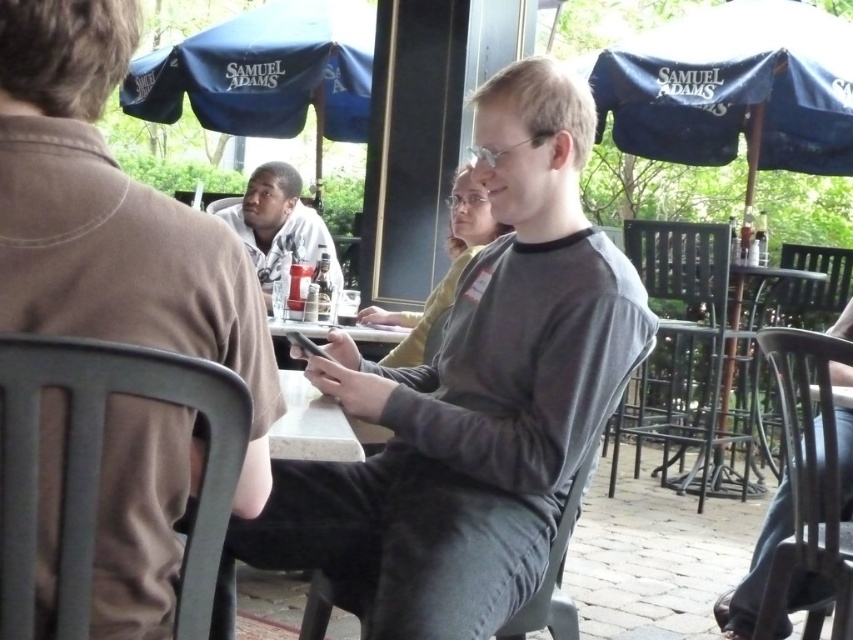
You are trying to reach the smooth plastic table at center from behind the gray matte shirt at center. Can you walk directly to the table without moving the shirt?

The gray matte shirt at center is in front of the smooth plastic table at center, so you cannot walk directly to the table without moving the shirt.

You are standing in the outdoor seating area and want to know which of the two points, point (267,220) or point (274,330), is closer to you. Can you determine this based on their positions?

Point (267,220) is closer to you than point (274,330) because it is further to the camera, which indicates it is nearer in the scene.